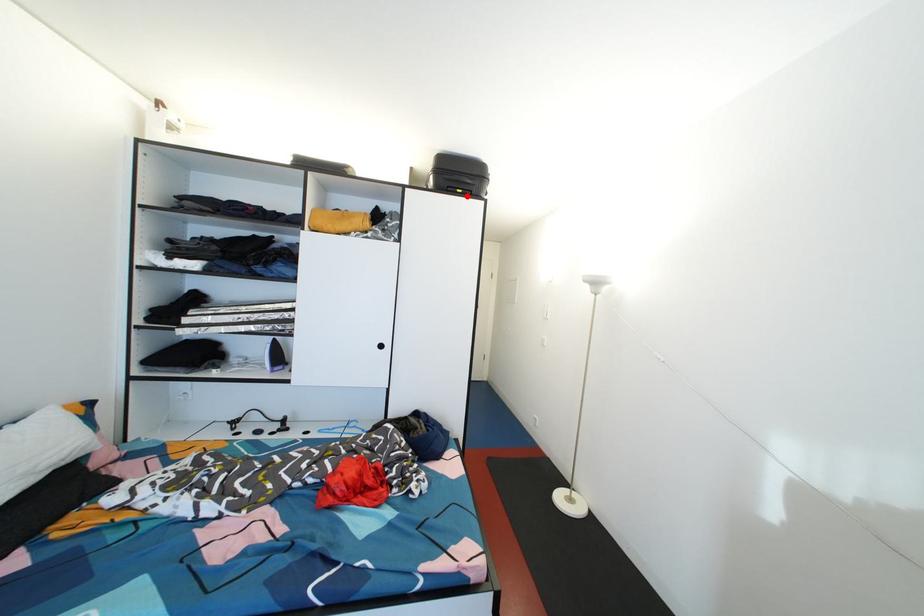
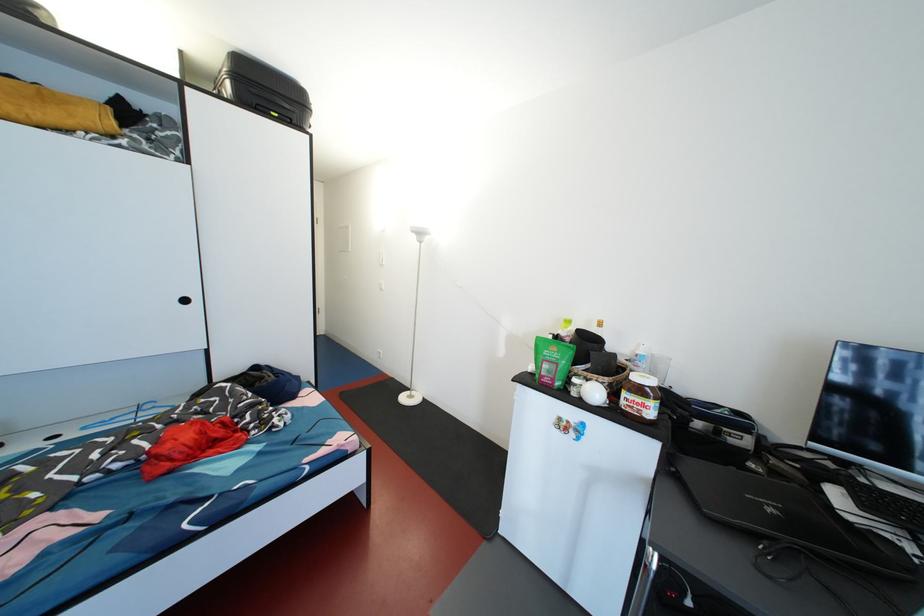
The point at the highlighted location is marked in the first image. Where is the corresponding point in the second image?

(283, 120)